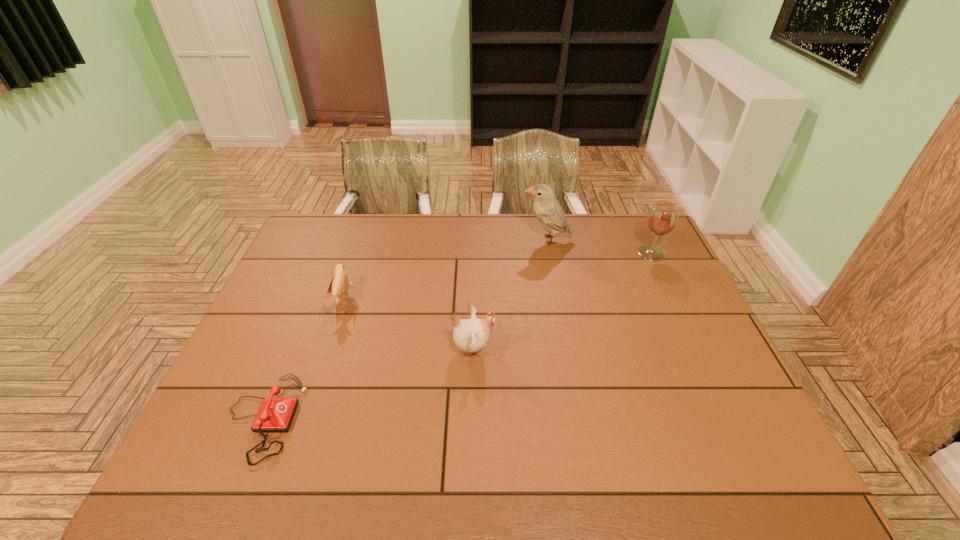
Identify the location of bird that stands as the closest to the tallest object. This screenshot has width=960, height=540. pyautogui.click(x=470, y=335).

Locate which bird is the third closest to the telephone. Please provide its 2D coordinates. Your answer should be formatted as a tuple, i.e. [(x, y)], where the tuple contains the x and y coordinates of a point satisfying the conditions above.

[(548, 211)]

Locate an element on the screen. The image size is (960, 540). free space that satisfies the following two spatial constraints: 1. at the face of the wineglass; 2. on the right side of the rightmost bird is located at coordinates [550, 253].

The height and width of the screenshot is (540, 960). Find the location of `free space that satisfies the following two spatial constraints: 1. on the front side of the rightmost object; 2. on the dial of the shortest object`. free space that satisfies the following two spatial constraints: 1. on the front side of the rightmost object; 2. on the dial of the shortest object is located at coordinates (730, 417).

At what (x,y) coordinates should I click in order to perform the action: click on free space that satisfies the following two spatial constraints: 1. on the front side of the rightmost object; 2. at the beak of the third shortest object. Please return your answer as a coordinate pair (x, y). Looking at the image, I should click on (697, 350).